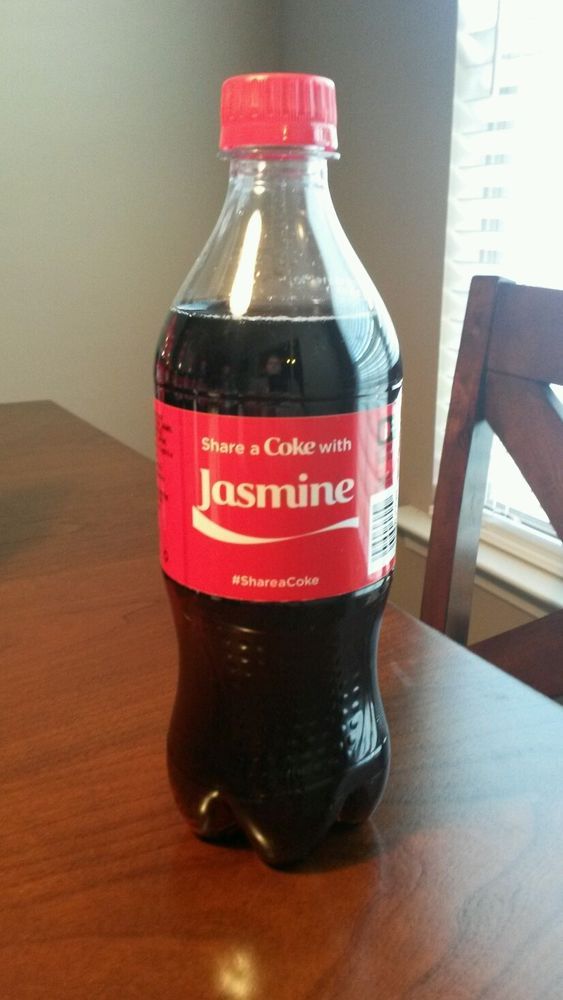
Locate an element on the screen. wood table is located at coordinates (133, 889).